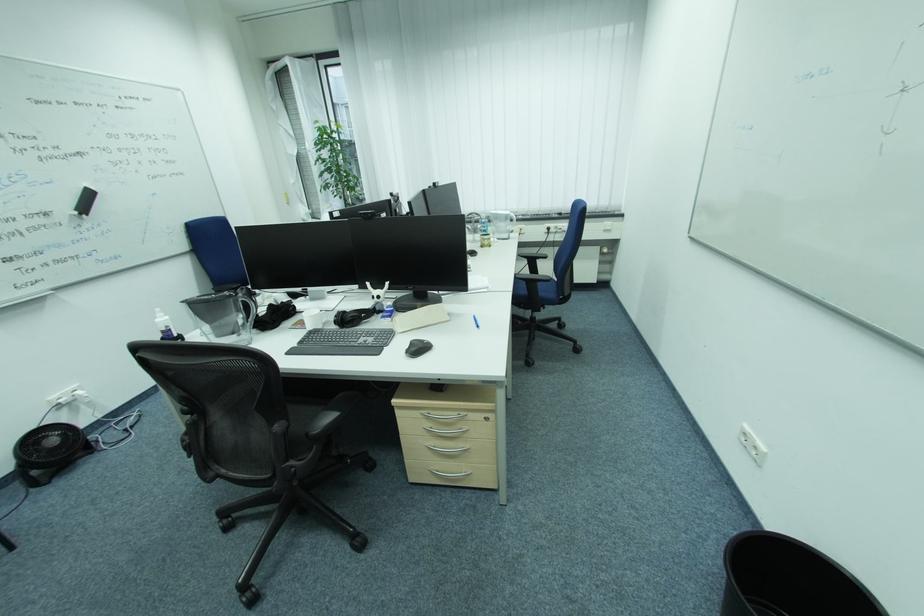
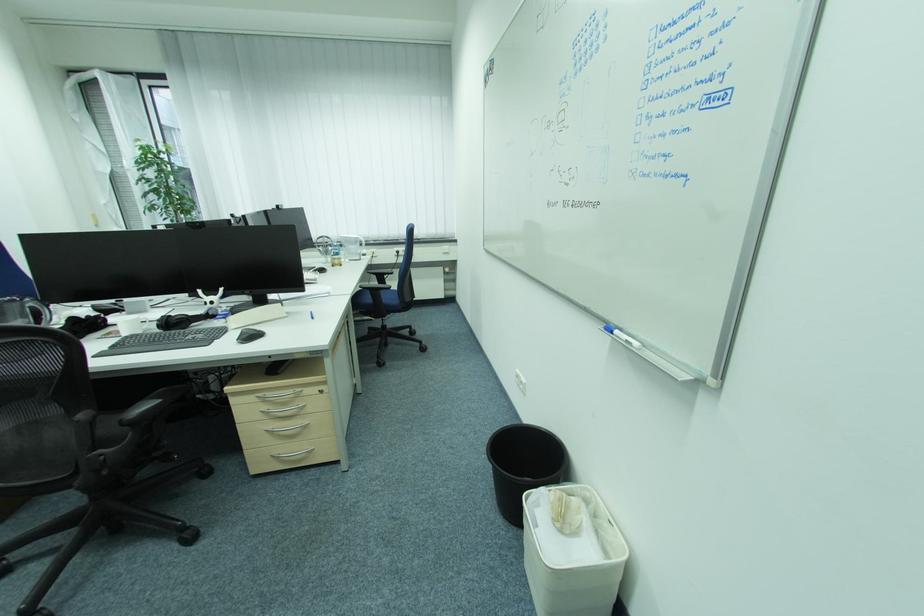
The point at (441, 448) is marked in the first image. Where is the corresponding point in the second image?

(281, 430)